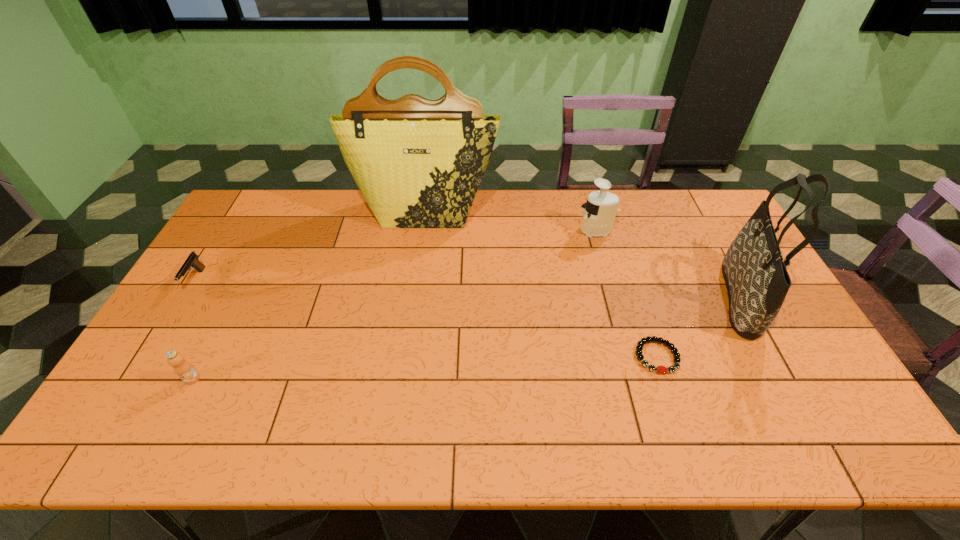
You are a GUI agent. You are given a task and a screenshot of the screen. Output one action in this format:
    pyautogui.click(x=<x>, y=<y>)
    Task: Click on the object present at the right edge
    This screenshot has height=540, width=960.
    Given the screenshot: What is the action you would take?
    coord(757,281)

Locate an element on the screen. This screenshot has width=960, height=540. vacant area at the far edge of the desktop is located at coordinates (323, 219).

Locate an element on the screen. The height and width of the screenshot is (540, 960). vacant space at the near edge is located at coordinates [747, 447].

This screenshot has height=540, width=960. Find the location of `vacant space at the left edge`. vacant space at the left edge is located at coordinates (181, 311).

The width and height of the screenshot is (960, 540). I want to click on vacant space at the right edge, so click(x=723, y=285).

Locate an element on the screen. vacant area at the far right corner is located at coordinates (688, 201).

Locate an element on the screen. The width and height of the screenshot is (960, 540). vacant space in between the juicer and the orange juice is located at coordinates (395, 305).

Locate an element on the screen. Image resolution: width=960 pixels, height=540 pixels. vacant region between the fifth object from right to left and the shortest object is located at coordinates (424, 368).

Find the location of a particular element. The width and height of the screenshot is (960, 540). empty space between the nearer tote bag and the fourth tallest object is located at coordinates (466, 338).

This screenshot has width=960, height=540. Identify the location of free spot between the second tallest object and the pistol. (468, 289).